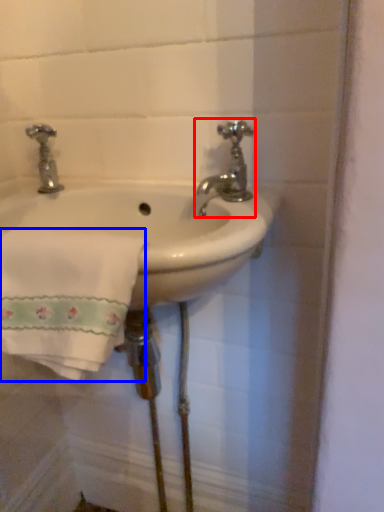
Question: Among these objects, which one is farthest to the camera, tap (highlighted by a red box) or bath towel (highlighted by a blue box)?

Choices:
 (A) tap
 (B) bath towel

Answer: (A)